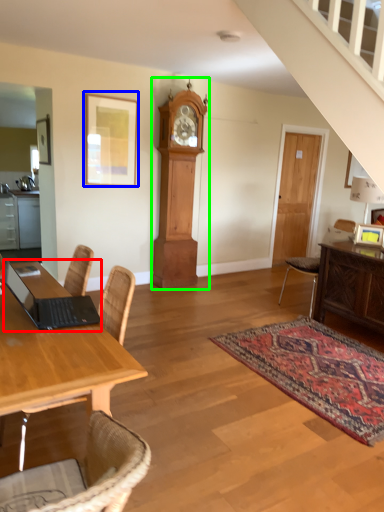
Question: Considering the real-world distances, which object is farthest from laptop (highlighted by a red box)? picture frame (highlighted by a blue box) or clock (highlighted by a green box)?

Choices:
 (A) picture frame
 (B) clock

Answer: (B)